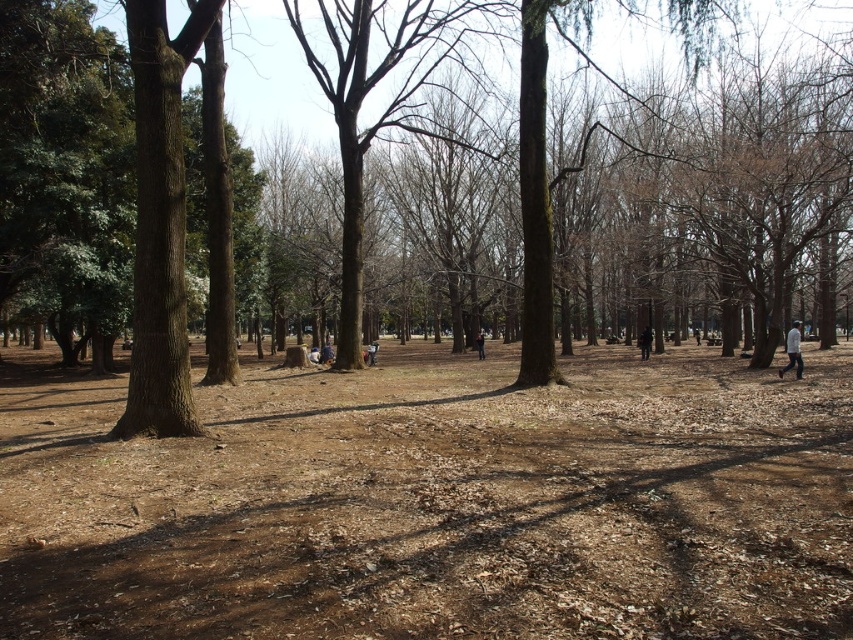
Is brown/dry soil at center in front of dark blue jeans at center?

Yes, brown/dry soil at center is in front of dark blue jeans at center.

Which is more to the right, brown/dry soil at center or dark blue jeans at center?

dark blue jeans at center is more to the right.

Which is in front, point (238, 461) or point (477, 346)?

Point (238, 461) is more forward.

In order to click on brown/dry soil at center in this screenshot , I will do (434, 500).

Does brown textured tree at center have a smaller size compared to white cotton shirt at right?

No.

Does brown textured tree at center have a greater height compared to white cotton shirt at right?

Indeed, brown textured tree at center has a greater height compared to white cotton shirt at right.

Measure the distance between brown textured tree at center and camera.

They are 9.51 meters apart.

The width and height of the screenshot is (853, 640). I want to click on brown textured tree at center, so click(x=548, y=189).

Can you confirm if brown/dry soil at center is positioned to the left of white cotton shirt at right?

Correct, you'll find brown/dry soil at center to the left of white cotton shirt at right.

Between brown/dry soil at center and white cotton shirt at right, which one is positioned higher?

white cotton shirt at right

Who is more distant from viewer, (309, 616) or (787, 340)?

The point (787, 340) is more distant.

Identify the location of brown/dry soil at center. (434, 500).